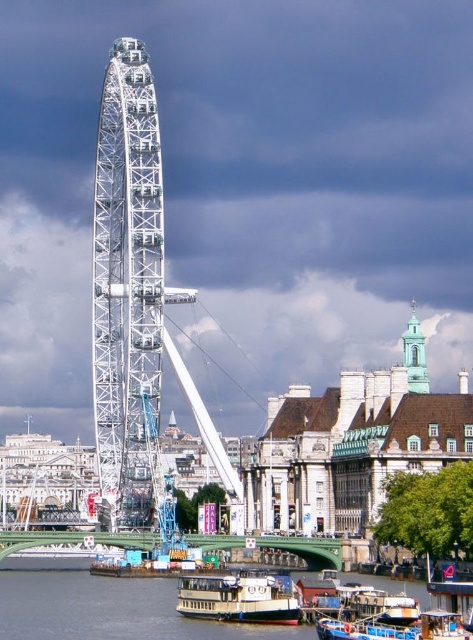
Can you confirm if smooth water at lower center is positioned to the right of light blue glass tower at upper right?

In fact, smooth water at lower center is to the left of light blue glass tower at upper right.

Which is in front, point (123, 621) or point (423, 378)?

Positioned in front is point (123, 621).

Does point (52, 604) come behind point (422, 374)?

No, (52, 604) is closer to viewer.

At what (x,y) coordinates should I click in order to perform the action: click on smooth water at lower center. Please return your answer as a coordinate pair (x, y). This screenshot has width=473, height=640. Looking at the image, I should click on (105, 605).

Locate an element on the screen. The width and height of the screenshot is (473, 640). smooth water at lower center is located at coordinates (105, 605).

Who is more distant from viewer, [150,582] or [384,627]?

Point [150,582]

The width and height of the screenshot is (473, 640). What are the coordinates of `smooth water at lower center` in the screenshot? It's located at (105, 605).

Between point (88, 589) and point (292, 620), which one is positioned in front?

Point (292, 620)

This screenshot has height=640, width=473. Identify the location of smooth water at lower center. (105, 605).